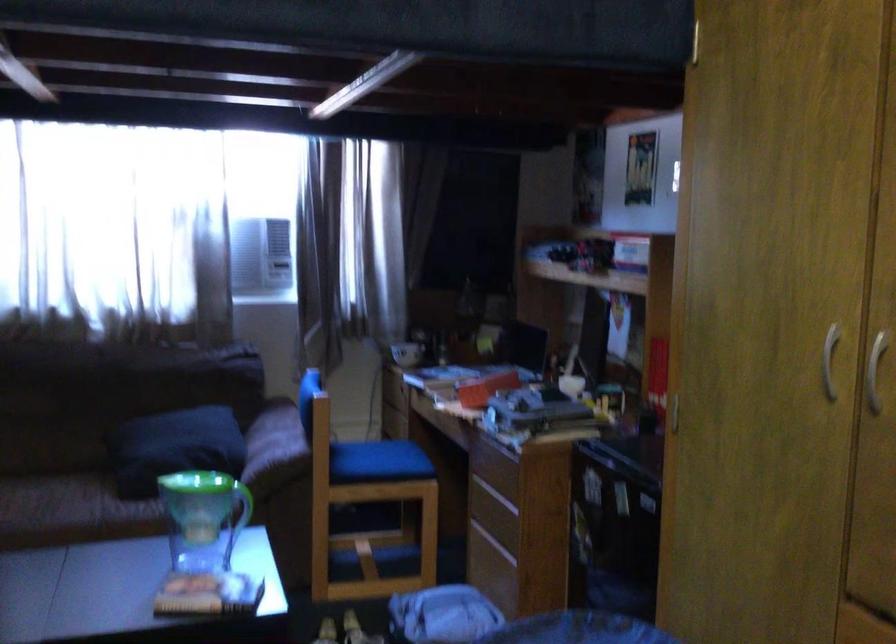
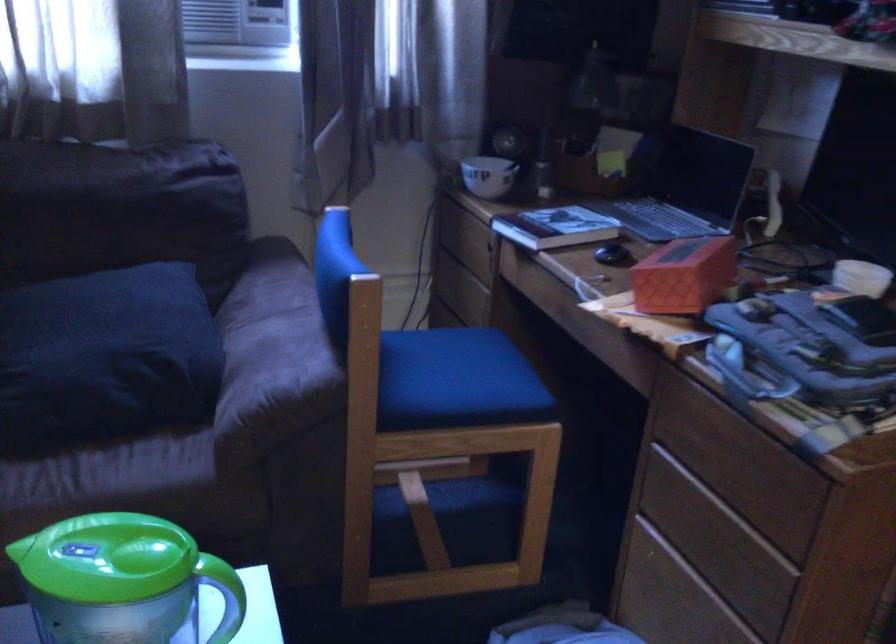
In the second image, find the point that corresponds to pixel 462 384 in the first image.

(612, 254)